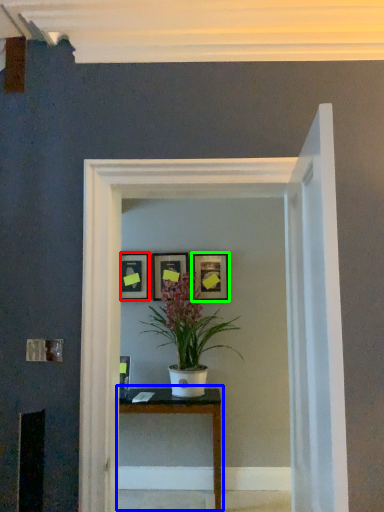
Question: Considering the real-world distances, which object is closest to picture frame (highlighted by a red box)? table (highlighted by a blue box) or picture frame (highlighted by a green box).

Choices:
 (A) table
 (B) picture frame

Answer: (B)